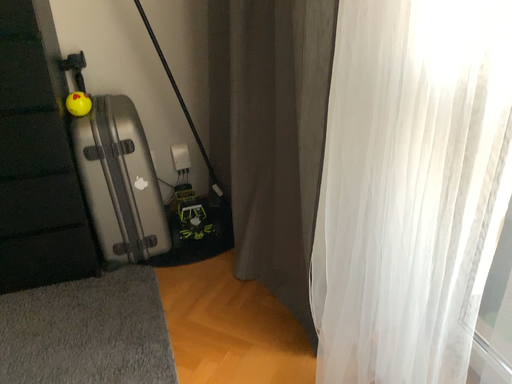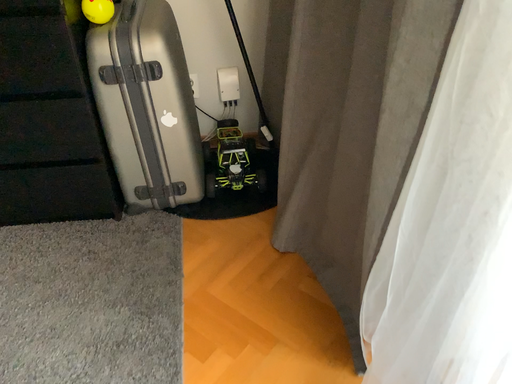
Question: Which way did the camera rotate in the video?

Choices:
 (A) rotated right
 (B) rotated left

Answer: (B)